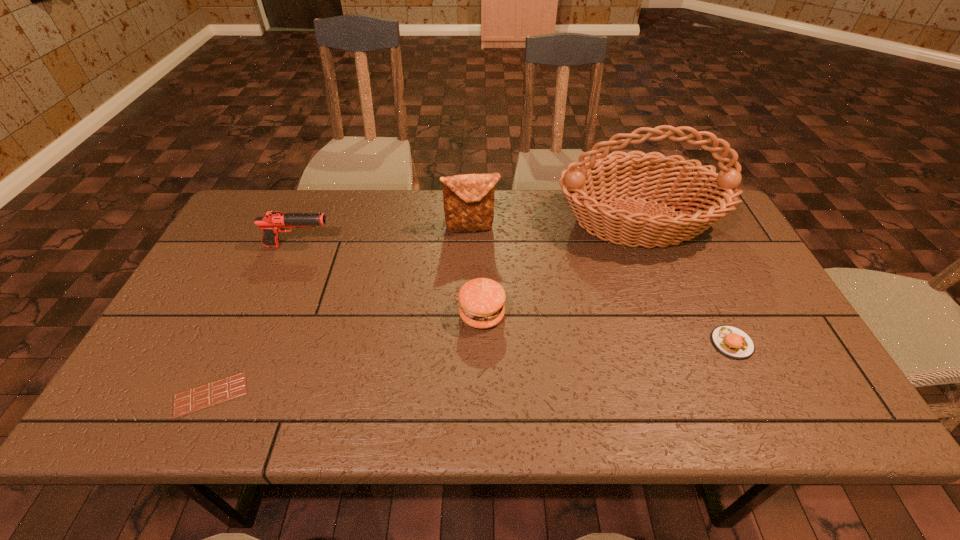
In order to click on object that is the closest to the fourth tallest object in this screenshot , I will do `click(601, 177)`.

The height and width of the screenshot is (540, 960). I want to click on blank area in the image that satisfies the following two spatial constraints: 1. on the back side of the shortest object; 2. on the right side of the shorter patty, so click(235, 343).

Locate an element on the screen. The image size is (960, 540). vacant space that satisfies the following two spatial constraints: 1. on the front side of the taller patty; 2. on the left side of the second shortest object is located at coordinates (482, 343).

Where is `free space that satisfies the following two spatial constraints: 1. on the open side of the clutch bag; 2. on the right side of the second shortest object`? This screenshot has width=960, height=540. free space that satisfies the following two spatial constraints: 1. on the open side of the clutch bag; 2. on the right side of the second shortest object is located at coordinates (469, 343).

What are the coordinates of `free space that satisfies the following two spatial constraints: 1. on the front side of the tallest object; 2. at the aiming end of the fourth shortest object` in the screenshot? It's located at [x=646, y=246].

You are a GUI agent. You are given a task and a screenshot of the screen. Output one action in this format:
    pyautogui.click(x=<x>, y=<y>)
    Task: Click on the vacant space that satisfies the following two spatial constraints: 1. at the aiming end of the fourth shortest object; 2. on the front side of the shortest object
    The width and height of the screenshot is (960, 540).
    Given the screenshot: What is the action you would take?
    pyautogui.click(x=235, y=395)